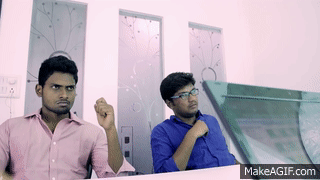
Locate the blinds when it hits 2nd frame in the image. Your answer should be formatted as a list of tuples, i.e. [(x1, y1), (x2, y2), ...], where each tuple contains the x and y coordinates of a point satisfying the conditions above.

[(244, 41)]